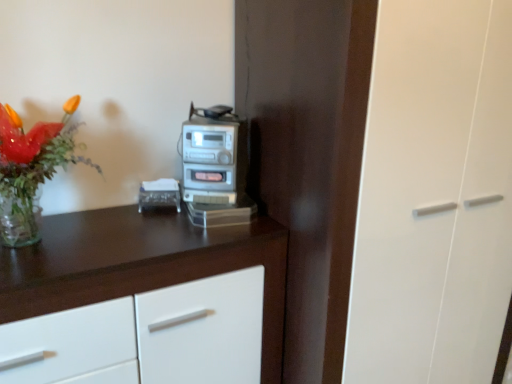
I want to click on vacant space in translucent glass vase at upper left (from a real-world perspective), so click(54, 239).